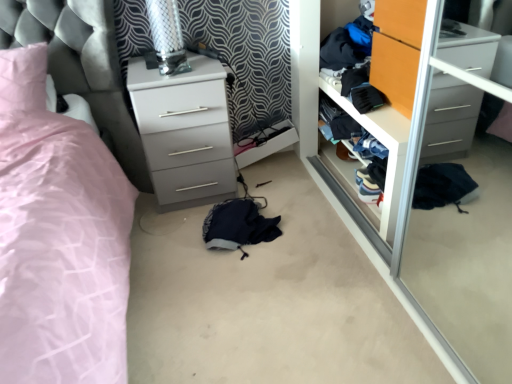
I want to click on free space that is in between wooden closet door at center and navy blue fabric at center, so click(x=307, y=207).